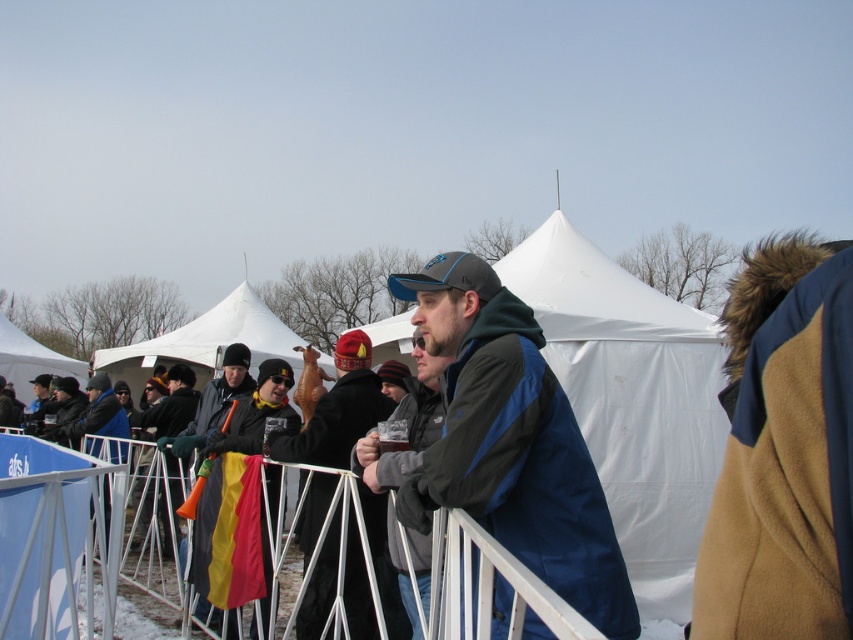
Can you confirm if matte black jacket at center is positioned above white fabric canopy at upper left?

No, matte black jacket at center is not above white fabric canopy at upper left.

Is matte black jacket at center to the right of white fabric canopy at upper left from the viewer's perspective?

Correct, you'll find matte black jacket at center to the right of white fabric canopy at upper left.

Describe the element at coordinates (337, 410) in the screenshot. I see `matte black jacket at center` at that location.

The width and height of the screenshot is (853, 640). What are the coordinates of `matte black jacket at center` in the screenshot? It's located at (337, 410).

Can you confirm if dark blue fleece jacket at center is taller than matte black jacket at center?

In fact, dark blue fleece jacket at center may be shorter than matte black jacket at center.

Is point (412, 284) positioned after point (334, 557)?

No, it is not.

Where is `dark blue fleece jacket at center`? The width and height of the screenshot is (853, 640). dark blue fleece jacket at center is located at coordinates (509, 442).

Between dark blue fleece jacket at center and orange plastic megaphone at center, which one has more height?

With more height is dark blue fleece jacket at center.

I want to click on dark blue fleece jacket at center, so (x=509, y=442).

You are a GUI agent. You are given a task and a screenshot of the screen. Output one action in this format:
    pyautogui.click(x=<x>, y=<y>)
    Task: Click on the dark blue fleece jacket at center
    Image resolution: width=853 pixels, height=640 pixels.
    Given the screenshot: What is the action you would take?
    pyautogui.click(x=509, y=442)